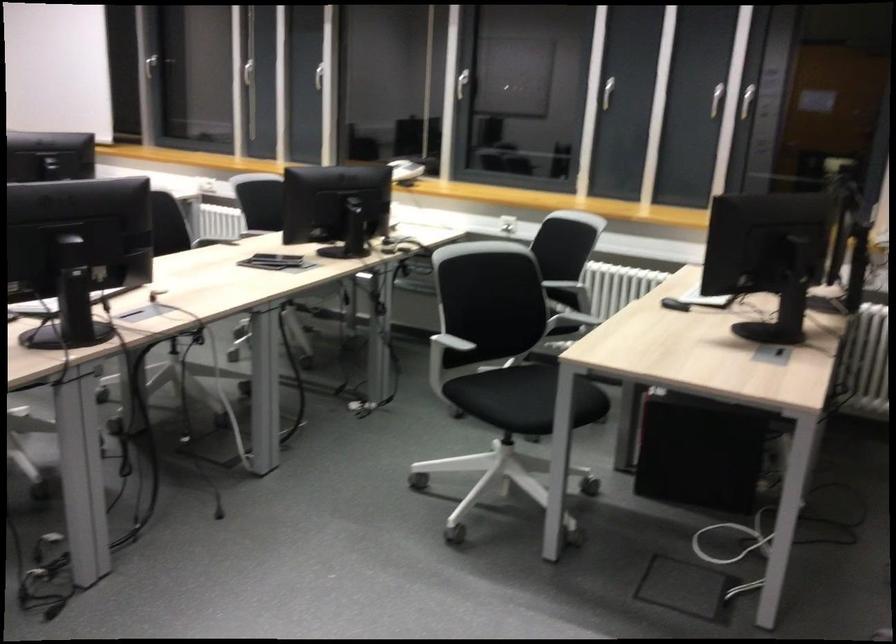
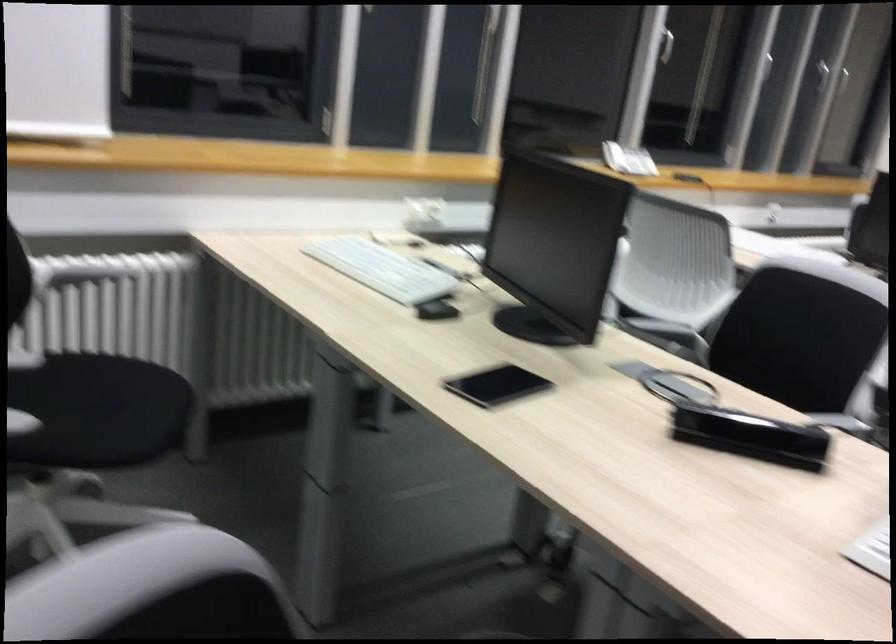
The point at (666,90) is marked in the first image. Where is the corresponding point in the second image?

(821, 76)